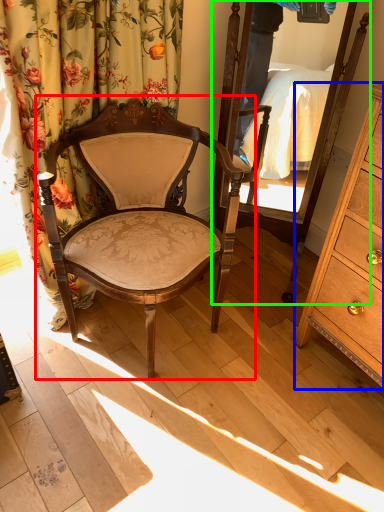
Question: Which object is positioned closest to chair (highlighted by a red box)? Select from cabinetry (highlighted by a blue box) and mirror (highlighted by a green box).

Choices:
 (A) cabinetry
 (B) mirror

Answer: (B)